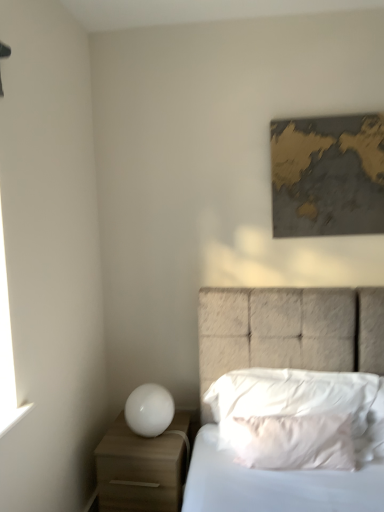
Question: From the image's perspective, is white soft pillow at center, placed as the first pillow when sorted from front to back, located beneath white soft pillow at center, the 1th pillow in the back-to-front sequence?

Choices:
 (A) no
 (B) yes

Answer: (B)

Question: Is white soft pillow at center, placed as the first pillow when sorted from front to back, positioned in front of white soft pillow at center, the 1th pillow in the back-to-front sequence?

Choices:
 (A) yes
 (B) no

Answer: (A)

Question: Is white soft pillow at center, the 2th pillow positioned from the back, oriented away from white soft pillow at center, the 1th pillow in the back-to-front sequence?

Choices:
 (A) yes
 (B) no

Answer: (A)

Question: Considering the relative sizes of white soft pillow at center, placed as the first pillow when sorted from front to back, and white soft pillow at center, the 1th pillow in the back-to-front sequence, in the image provided, is white soft pillow at center, placed as the first pillow when sorted from front to back, thinner than white soft pillow at center, the 1th pillow in the back-to-front sequence,?

Choices:
 (A) yes
 (B) no

Answer: (A)

Question: Is white soft pillow at center, the 2th pillow positioned from the back, bigger than white soft pillow at center, the 1th pillow in the back-to-front sequence?

Choices:
 (A) no
 (B) yes

Answer: (A)

Question: From the image's perspective, is white soft pillow at center, placed as the first pillow when sorted from front to back, above white soft pillow at center, the 1th pillow in the back-to-front sequence?

Choices:
 (A) yes
 (B) no

Answer: (B)

Question: Does gold metallic map at upper right have a greater height compared to white soft pillow at center, placed as the 2th pillow when sorted from front to back?

Choices:
 (A) yes
 (B) no

Answer: (A)

Question: From the image's perspective, is gold metallic map at upper right located above white soft pillow at center, placed as the 2th pillow when sorted from front to back?

Choices:
 (A) no
 (B) yes

Answer: (B)

Question: Can we say gold metallic map at upper right lies outside white soft pillow at center, placed as the 2th pillow when sorted from front to back?

Choices:
 (A) no
 (B) yes

Answer: (B)

Question: Does gold metallic map at upper right have a smaller size compared to white soft pillow at center, the 1th pillow in the back-to-front sequence?

Choices:
 (A) yes
 (B) no

Answer: (A)

Question: Does gold metallic map at upper right have a larger size compared to white soft pillow at center, placed as the 2th pillow when sorted from front to back?

Choices:
 (A) yes
 (B) no

Answer: (B)

Question: Is white soft pillow at center, placed as the 2th pillow when sorted from front to back, inside gold metallic map at upper right?

Choices:
 (A) no
 (B) yes

Answer: (A)

Question: Does white glossy sphere at lower left turn towards textured fabric bed at center?

Choices:
 (A) yes
 (B) no

Answer: (B)